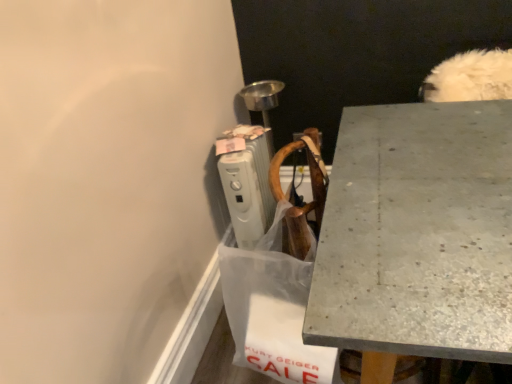
Question: Is white plastic radiator at upper center bigger than granite gray desk at upper right?

Choices:
 (A) yes
 (B) no

Answer: (B)

Question: Is granite gray desk at upper right surrounded by white plastic radiator at upper center?

Choices:
 (A) yes
 (B) no

Answer: (B)

Question: Is white plastic radiator at upper center touching granite gray desk at upper right?

Choices:
 (A) no
 (B) yes

Answer: (A)

Question: From a real-world perspective, is white plastic radiator at upper center positioned under granite gray desk at upper right based on gravity?

Choices:
 (A) yes
 (B) no

Answer: (B)

Question: Is white plastic radiator at upper center shorter than granite gray desk at upper right?

Choices:
 (A) yes
 (B) no

Answer: (A)

Question: Is transparent plastic shopping bag at lower center spatially inside white plastic radiator at upper center, or outside of it?

Choices:
 (A) outside
 (B) inside

Answer: (A)

Question: From the image's perspective, is transparent plastic shopping bag at lower center located above or below white plastic radiator at upper center?

Choices:
 (A) above
 (B) below

Answer: (B)

Question: Considering their positions, is transparent plastic shopping bag at lower center located in front of or behind white plastic radiator at upper center?

Choices:
 (A) front
 (B) behind

Answer: (A)

Question: In terms of width, does transparent plastic shopping bag at lower center look wider or thinner when compared to white plastic radiator at upper center?

Choices:
 (A) wide
 (B) thin

Answer: (B)

Question: Do you think granite gray desk at upper right is within transparent plastic shopping bag at lower center, or outside of it?

Choices:
 (A) inside
 (B) outside

Answer: (B)

Question: In the image, is granite gray desk at upper right positioned in front of or behind transparent plastic shopping bag at lower center?

Choices:
 (A) behind
 (B) front

Answer: (B)

Question: Is point (360, 319) closer or farther from the camera than point (272, 327)?

Choices:
 (A) closer
 (B) farther

Answer: (A)

Question: Considering the positions of granite gray desk at upper right and transparent plastic shopping bag at lower center in the image, is granite gray desk at upper right wider or thinner than transparent plastic shopping bag at lower center?

Choices:
 (A) thin
 (B) wide

Answer: (B)

Question: Is transparent plastic shopping bag at lower center taller or shorter than granite gray desk at upper right?

Choices:
 (A) tall
 (B) short

Answer: (B)

Question: Considering the relative positions of transparent plastic shopping bag at lower center and granite gray desk at upper right in the image provided, is transparent plastic shopping bag at lower center to the left or to the right of granite gray desk at upper right?

Choices:
 (A) left
 (B) right

Answer: (A)